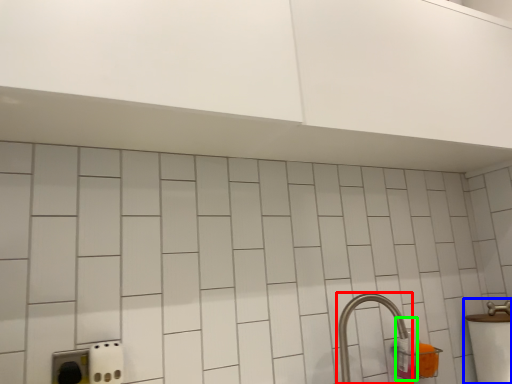
Question: Estimate the real-world distances between objects in this image. Which object is closer to tap (highlighted by a red box), sink (highlighted by a blue box) or bottle (highlighted by a green box)?

Choices:
 (A) sink
 (B) bottle

Answer: (B)